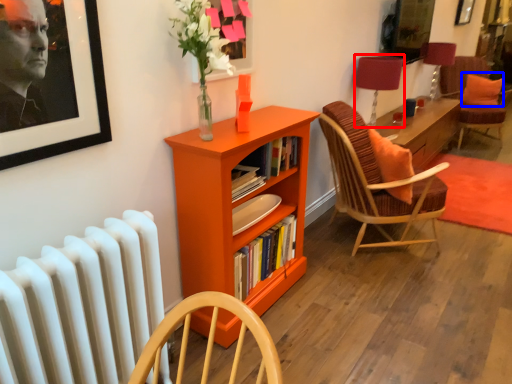
Question: Which object is closer to the camera taking this photo, table lamp (highlighted by a red box) or pillow (highlighted by a blue box)?

Choices:
 (A) table lamp
 (B) pillow

Answer: (A)